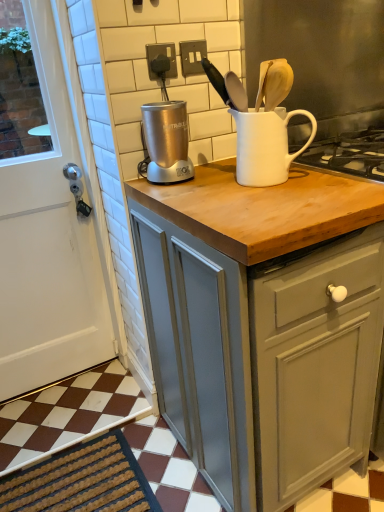
You are a GUI agent. You are given a task and a screenshot of the screen. Output one action in this format:
    pyautogui.click(x=<x>, y=<y>)
    Task: Click on the vacant space in front of satin silver blender at upper center
    This screenshot has width=384, height=512.
    Given the screenshot: What is the action you would take?
    pyautogui.click(x=190, y=188)